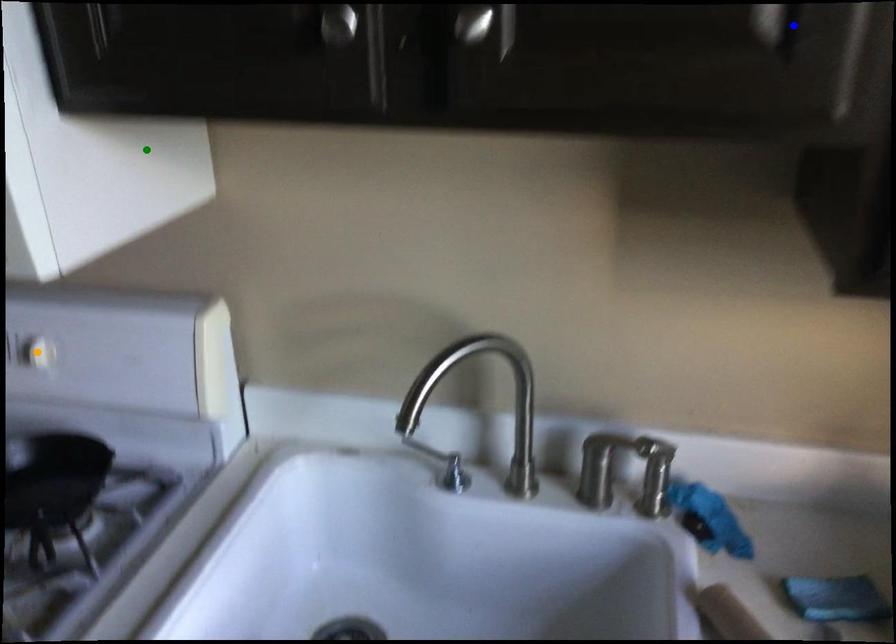
Order these from nearest to farthest:
green point
orange point
blue point

1. orange point
2. green point
3. blue point